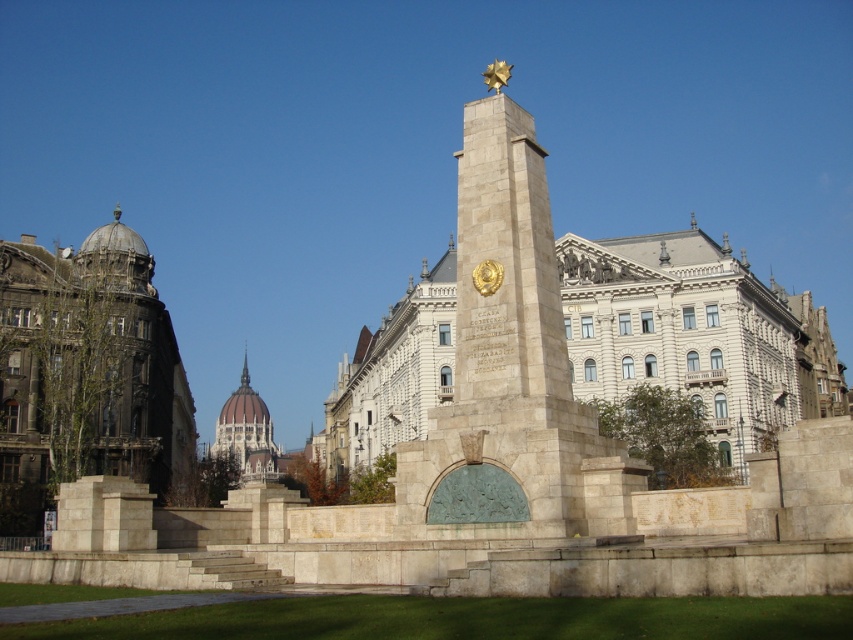
You are an architect evaluating the central area of a public square. You observe the beige stone monument at center and the greenish stone dome at center. Based on their sizes, which one would require more materials to construct?

The beige stone monument at center is larger in size than the greenish stone dome at center, so it would require more materials to construct.

You are standing in the public square and want to take a photo of the stone obelisk at center. To ensure the greenish stone dome at center is not blocking the view, should you move forward or backward?

The stone obelisk at center is in front of the greenish stone dome at center, so you should move backward to ensure the greenish stone dome at center is not blocking the view.